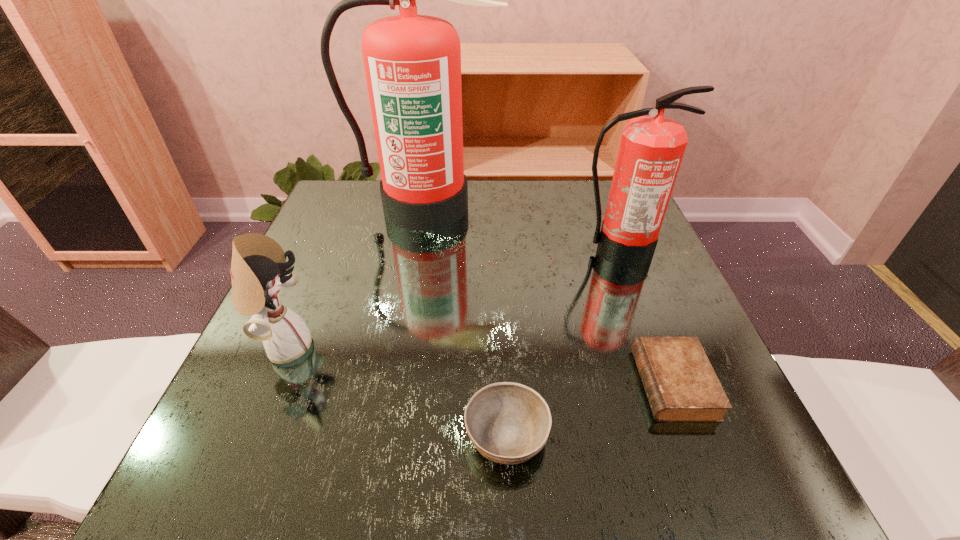
I want to click on vacant point that satisfies the following two spatial constraints: 1. on the spine side of the diary; 2. on the front side of the second shortest object, so click(693, 435).

Where is `blank area in the image that satisfies the following two spatial constraints: 1. at the nozzle of the bowl; 2. on the left side of the tallest object`? blank area in the image that satisfies the following two spatial constraints: 1. at the nozzle of the bowl; 2. on the left side of the tallest object is located at coordinates (388, 435).

The width and height of the screenshot is (960, 540). Find the location of `vacant point that satisfies the following two spatial constraints: 1. on the front side of the nearer fire extinguisher; 2. at the front face of the doll`. vacant point that satisfies the following two spatial constraints: 1. on the front side of the nearer fire extinguisher; 2. at the front face of the doll is located at coordinates (656, 347).